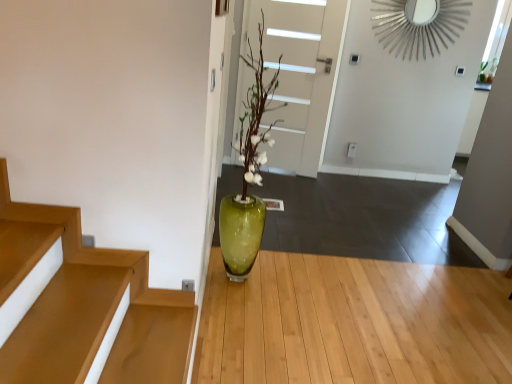
What is the approximate width of white matte door at center?

6.93 inches.

Where is `green glass vase at center`? The width and height of the screenshot is (512, 384). green glass vase at center is located at coordinates (353, 323).

Are green glass vase at center and green glass vase at center far apart?

No, green glass vase at center is not far from green glass vase at center.

Looking at this image, considering the sizes of objects green glass vase at center and green glass vase at center in the image provided, who is bigger, green glass vase at center or green glass vase at center?

With larger size is green glass vase at center.

Is green glass vase at center at the back of green glass vase at center?

That's not correct — green glass vase at center is not looking away from green glass vase at center.

The width and height of the screenshot is (512, 384). I want to click on hardwood on the right of the green glass vase at center, so click(x=353, y=323).

Is green glass vase at center further to the viewer compared to white matte door at center?

No, the depth of green glass vase at center is less than that of white matte door at center.

Between point (477, 339) and point (281, 113), which one is positioned behind?

The point (281, 113) is farther.

Which object is positioned more to the right, green glass vase at center or white matte door at center?

green glass vase at center.

Is green glass vase at center completely or partially outside of white matte door at center?

green glass vase at center lies outside white matte door at center's area.

From the image's perspective, does white matte door at center appear higher than green glass vase at center?

Yes.

Is white matte door at center outside of green glass vase at center?

Yes, white matte door at center is located beyond the bounds of green glass vase at center.

Does white matte door at center have a smaller size compared to green glass vase at center?

Correct, white matte door at center occupies less space than green glass vase at center.

Is white matte door at center shorter than green glass vase at center?

Incorrect, the height of white matte door at center does not fall short of that of green glass vase at center.

Where is `door on the right of green glass vase at center`? The height and width of the screenshot is (384, 512). door on the right of green glass vase at center is located at coordinates (298, 75).

Which is behind, green glass vase at center or white matte door at center?

white matte door at center is behind.

From a real-world perspective, is green glass vase at center above or below white matte door at center?

From a real-world perspective, green glass vase at center is physically below white matte door at center.

How far apart are green glass vase at center and white matte door at center?

green glass vase at center and white matte door at center are 1.71 meters apart from each other.

Considering the sizes of objects white matte door at center and green glass vase at center in the image provided, who is taller, white matte door at center or green glass vase at center?

white matte door at center.

Which of these two, white matte door at center or green glass vase at center, is thinner?

With smaller width is white matte door at center.

Is white matte door at center positioned with its back to green glass vase at center?

No, green glass vase at center is not at the back of white matte door at center.

Is white matte door at center positioned in front of green glass vase at center?

That is False.

Is the position of green glass vase at center less distant than that of green glass vase at center?

Yes, green glass vase at center is in front of green glass vase at center.

Can you tell me how much green glass vase at center and green glass vase at center differ in facing direction?

There is a 90-degree angle between the facing directions of green glass vase at center and green glass vase at center.

From a real-world perspective, which is physically below, green glass vase at center or green glass vase at center?

From a 3D spatial view, green glass vase at center is below.

Considering the sizes of green glass vase at center and green glass vase at center in the image, is green glass vase at center bigger or smaller than green glass vase at center?

green glass vase at center is bigger than green glass vase at center.

Locate an element on the screen. The height and width of the screenshot is (384, 512). hardwood that is under the green glass vase at center (from a real-world perspective) is located at coordinates (353, 323).

This screenshot has width=512, height=384. I want to click on door that is above the green glass vase at center (from the image's perspective), so click(298, 75).

When comparing their distances from white matte door at center, does green glass vase at center or green glass vase at center seem further?

green glass vase at center.

When comparing their distances from green glass vase at center, does white matte door at center or green glass vase at center seem further?

white matte door at center.

Which object lies nearer to the anchor point white matte door at center, green glass vase at center or green glass vase at center?

Answer: The object closer to white matte door at center is green glass vase at center.

Based on their spatial positions, is green glass vase at center or white matte door at center closer to green glass vase at center?

green glass vase at center is closer to green glass vase at center.

Based on their spatial positions, is green glass vase at center or white matte door at center closer to green glass vase at center?

green glass vase at center lies closer to green glass vase at center than the other object.

From the picture: From the image, which object appears to be farther from green glass vase at center, white matte door at center or green glass vase at center?

white matte door at center is positioned further to the anchor green glass vase at center.

At what (x,y) coordinates should I click in order to perform the action: click on houseplant located between green glass vase at center and white matte door at center in the depth direction. Please return your answer as a coordinate pair (x, y). Looking at the image, I should click on (248, 173).